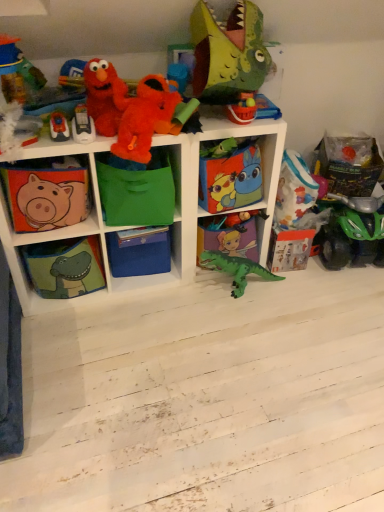
Locate an element on the screen. This screenshot has height=512, width=384. blank space situated above green matte dinosaur at center, which appears as the first shelf when viewed from the right (from a real-world perspective) is located at coordinates (223, 220).